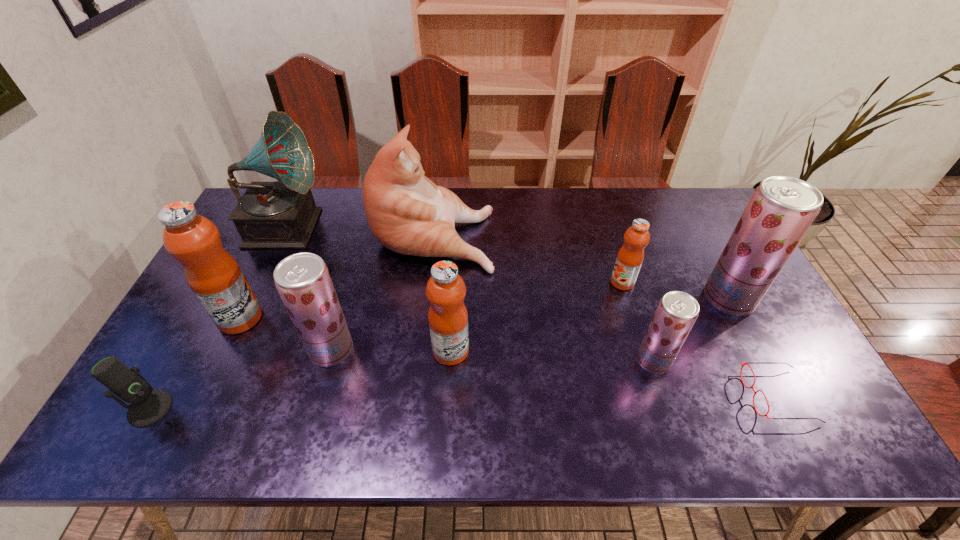
The height and width of the screenshot is (540, 960). I want to click on the second strawberry fruit juice from left to right, so click(x=676, y=313).

At what (x,y) coordinates should I click in order to perform the action: click on the farthest orange fruit juice. Please return your answer as a coordinate pair (x, y). The image size is (960, 540). Looking at the image, I should click on (630, 257).

Find the location of a particular element. This screenshot has width=960, height=540. the rightmost orange fruit juice is located at coordinates (630, 257).

Identify the location of the second shortest object. This screenshot has width=960, height=540. (148, 406).

Where is `the shortest object`? Image resolution: width=960 pixels, height=540 pixels. the shortest object is located at coordinates (747, 363).

The image size is (960, 540). Find the location of `red spectacles`. red spectacles is located at coordinates (747, 363).

Locate an element on the screen. free space located on the horn of the record player is located at coordinates (378, 225).

Find the location of a particular element. The width and height of the screenshot is (960, 540). blank area located on the face of the orange cat is located at coordinates (580, 233).

Locate an element on the screen. This screenshot has width=960, height=540. free region located 0.150m on the front of the rightmost fruit juice is located at coordinates (762, 364).

You are a GUI agent. You are given a task and a screenshot of the screen. Output one action in this format:
    pyautogui.click(x=<x>, y=<y>)
    Task: Click on the blank space located on the front label of the biggest orange fruit juice
    This screenshot has height=540, width=960.
    Given the screenshot: What is the action you would take?
    pyautogui.click(x=337, y=318)